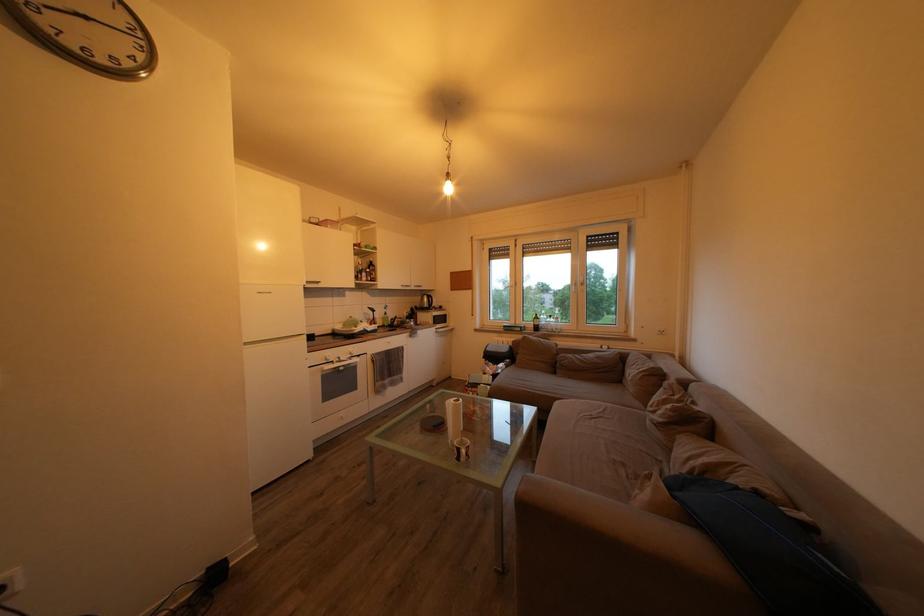
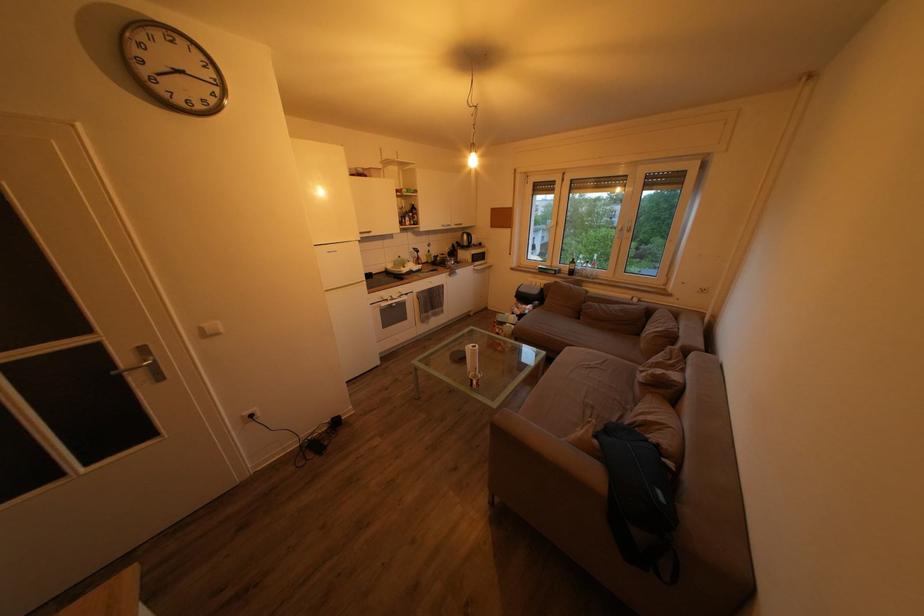
Where in the second image is the point corresponding to point 420,294 from the first image?

(462, 233)